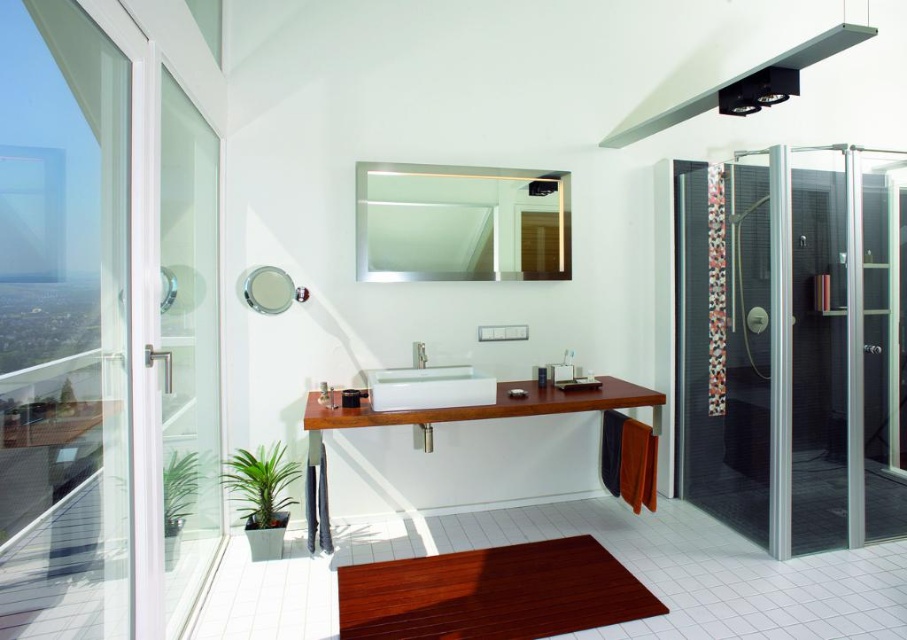
You are standing in the bathroom and want to reach the teak wood vanity at center from the transparent glass shower door at right. Which direction should you move towards?

You should move towards the left to reach the teak wood vanity at center from the transparent glass shower door at right because the teak wood vanity at center is behind the shower door, indicating it is positioned to the left side of the shower door.

You are standing in the bathroom and want to reach the transparent glass shower door at right without stepping on the white glossy sink at center. Is this possible?

The transparent glass shower door at right is in front of the white glossy sink at center, so you can reach the transparent glass shower door at right without stepping on the sink as it is positioned in front of it.